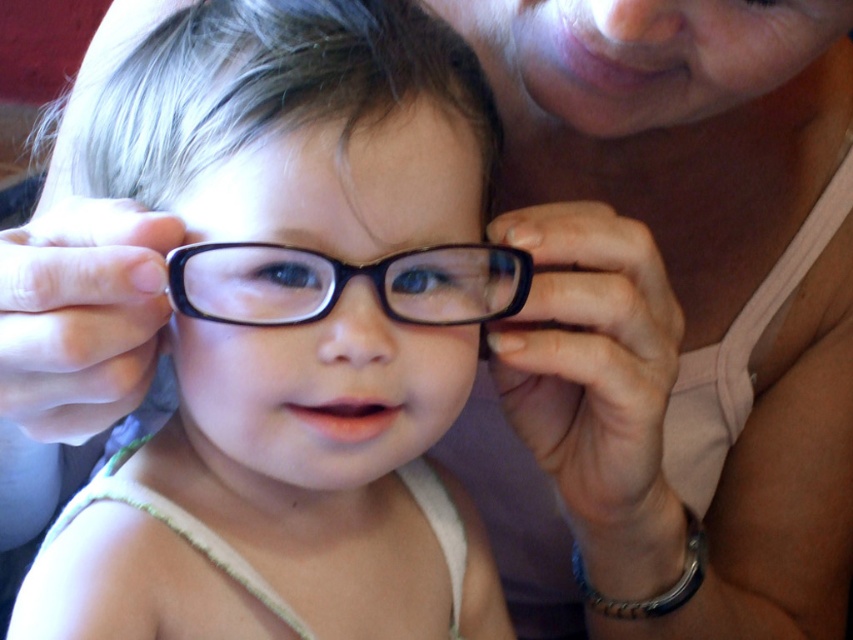
The scene shows a child wearing glasses and an adult adjusting them. Where exactly are the matte black glasses at center located in the image?

The matte black glasses at center are located at point coordinates of 0.525 on the x axis and 0.347 on the y axis.

You are a photographer trying to capture the perfect shot of the child wearing glasses. You have two options for glasses placement in the frame. The matte black glasses at center and the black plastic glasses at center. Which glasses should you choose if you want the glasses to appear wider in the photo?

You should choose the matte black glasses at center because they might be wider than the black plastic glasses at center according to the description.